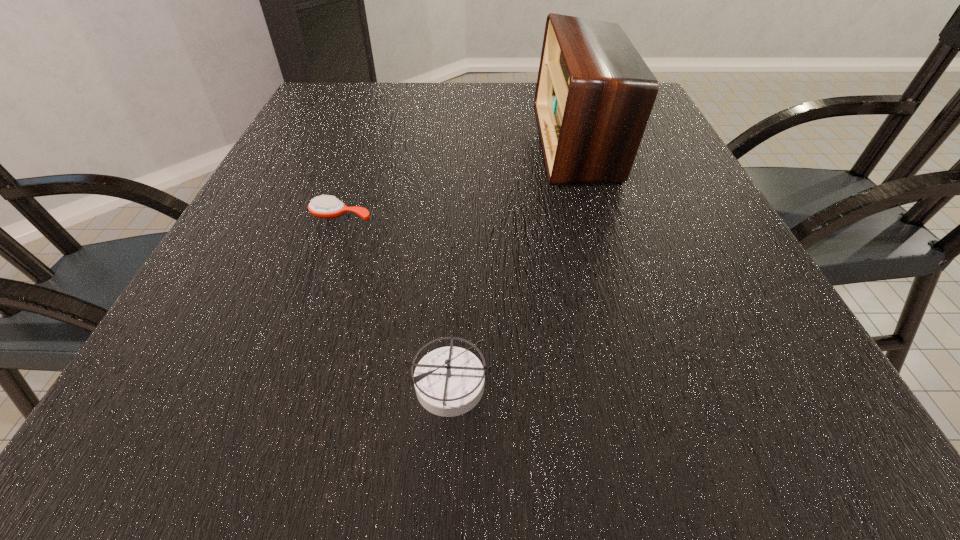
Find the location of a particular element. The image size is (960, 540). free point at the far right corner is located at coordinates (660, 118).

This screenshot has width=960, height=540. Find the location of `free space between the nearest object and the leftmost object`. free space between the nearest object and the leftmost object is located at coordinates (396, 299).

Locate an element on the screen. The width and height of the screenshot is (960, 540). free spot between the second shortest object and the radio receiver is located at coordinates (514, 262).

Identify the location of free spot between the rightmost object and the hairbrush. (459, 179).

Where is `empty space that is in between the second shortest object and the hairbrush`? The width and height of the screenshot is (960, 540). empty space that is in between the second shortest object and the hairbrush is located at coordinates (396, 299).

What are the coordinates of `free space between the radio receiver and the second object from left to right` in the screenshot? It's located at (514, 262).

Find the location of a particular element. The width and height of the screenshot is (960, 540). free space between the second tallest object and the rightmost object is located at coordinates (514, 262).

Where is `empty location between the second farthest object and the second object from left to right`? The image size is (960, 540). empty location between the second farthest object and the second object from left to right is located at coordinates (396, 299).

At what (x,y) coordinates should I click in order to perform the action: click on free area in between the second object from right to left and the second nearest object. Please return your answer as a coordinate pair (x, y). Image resolution: width=960 pixels, height=540 pixels. Looking at the image, I should click on (396, 299).

This screenshot has width=960, height=540. Find the location of `vacant area that lies between the leftmost object and the tallest object`. vacant area that lies between the leftmost object and the tallest object is located at coordinates (459, 179).